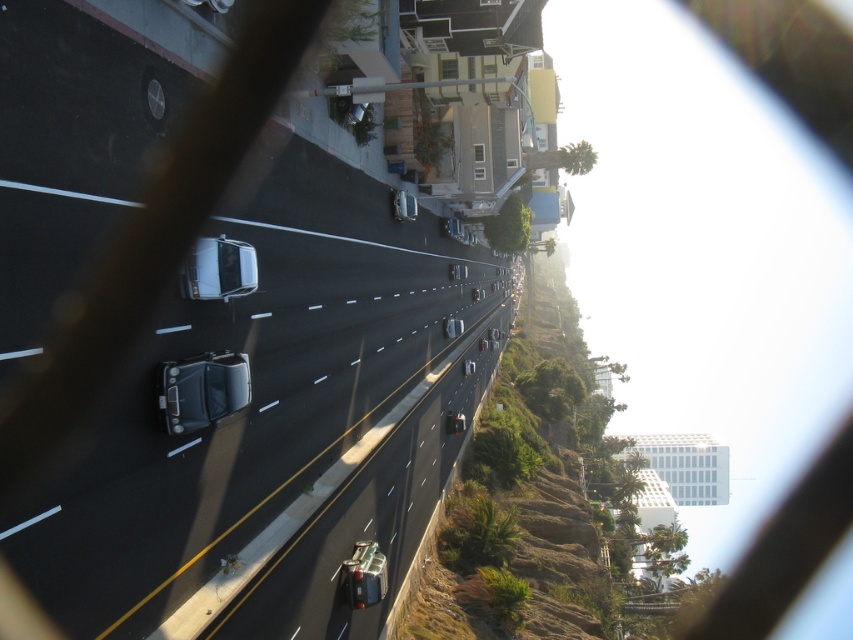
Can you confirm if white glossy sedan at center is bigger than shiny silver sedan at center?

No.

Does white glossy sedan at center have a lesser width compared to shiny silver sedan at center?

No, white glossy sedan at center is not thinner than shiny silver sedan at center.

Where is `white glossy sedan at center`? Image resolution: width=853 pixels, height=640 pixels. white glossy sedan at center is located at coordinates (218, 269).

Between point (428, 616) and point (171, 410), which one is positioned behind?

The point (428, 616) is more distant.

I want to click on green grassy hillside at center, so click(x=525, y=493).

Is point (376, 630) farther from camera compared to point (206, 380)?

Yes, point (376, 630) is behind point (206, 380).

Image resolution: width=853 pixels, height=640 pixels. Identify the location of shiny silver car at center. (364, 506).

Does point (277, 605) lie behind point (170, 426)?

Yes, point (277, 605) is farther from viewer.

This screenshot has height=640, width=853. Identify the location of shiny silver car at center. pos(364,506).